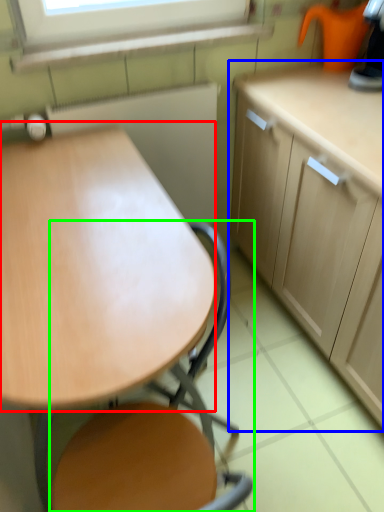
Question: Which object is the farthest from round table (highlighted by a red box)? Choose among these: cabinetry (highlighted by a blue box) or chair (highlighted by a green box).

Choices:
 (A) cabinetry
 (B) chair

Answer: (A)